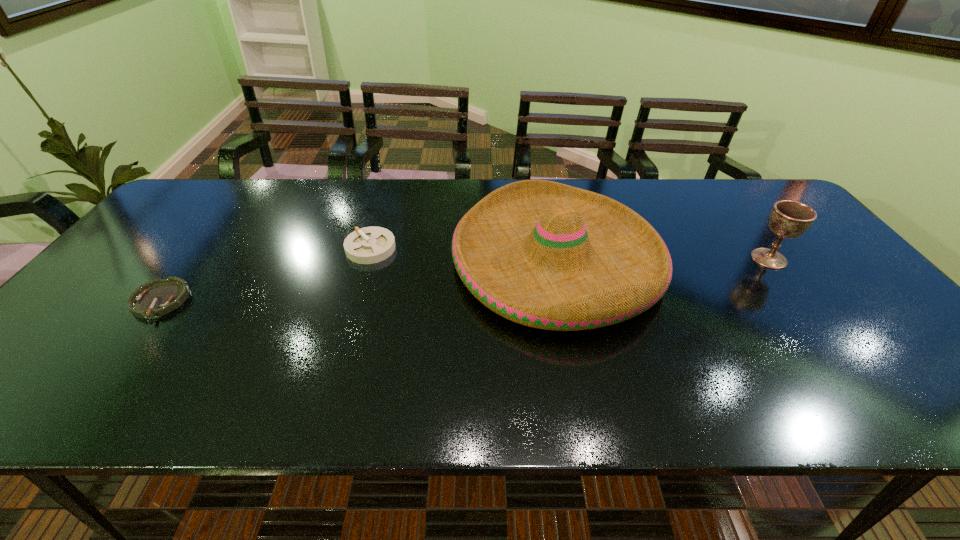
Find the location of a particular element. sombrero is located at coordinates (543, 254).

At what (x,y) coordinates should I click in order to perform the action: click on chalice. Please return your answer as a coordinate pair (x, y). This screenshot has height=540, width=960. Looking at the image, I should click on (789, 219).

You are a GUI agent. You are given a task and a screenshot of the screen. Output one action in this format:
    pyautogui.click(x=<x>, y=<y>)
    Task: Click on the second shortest object
    
    Given the screenshot: What is the action you would take?
    pyautogui.click(x=368, y=245)

Identify the location of the right ashtray. Image resolution: width=960 pixels, height=540 pixels. (368, 245).

The width and height of the screenshot is (960, 540). In order to click on the leftmost object in this screenshot , I will do `click(158, 297)`.

The width and height of the screenshot is (960, 540). I want to click on the left ashtray, so click(158, 297).

This screenshot has height=540, width=960. In order to click on blank area located on the left of the sombrero in this screenshot , I will do `click(324, 260)`.

Where is `free space located on the back of the chalice`? free space located on the back of the chalice is located at coordinates (730, 207).

This screenshot has width=960, height=540. In order to click on vacant area situated on the right of the taller ashtray in this screenshot , I will do `click(438, 248)`.

This screenshot has width=960, height=540. I want to click on free space located on the back of the shortest object, so (216, 227).